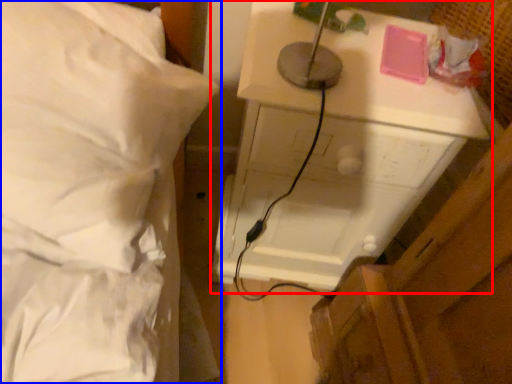
Question: Which object appears farthest to the camera in this image, furniture (highlighted by a red box) or bed (highlighted by a blue box)?

Choices:
 (A) furniture
 (B) bed

Answer: (A)